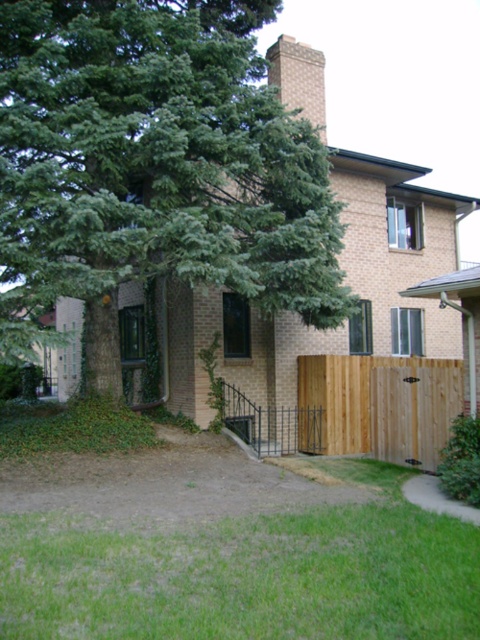
Can you confirm if green leafy tree at upper left is bigger than brown wooden fence at lower right?

Incorrect, green leafy tree at upper left is not larger than brown wooden fence at lower right.

Between green leafy tree at upper left and brown wooden fence at lower right, which one is positioned lower?

brown wooden fence at lower right

Locate an element on the screen. Image resolution: width=480 pixels, height=640 pixels. green leafy tree at upper left is located at coordinates (156, 164).

This screenshot has height=640, width=480. I want to click on green leafy tree at upper left, so click(156, 164).

Which of these two, brown wooden fence at lower right or brick chimney at upper center, stands taller?

Standing taller between the two is brick chimney at upper center.

Does brown wooden fence at lower right appear on the left side of brick chimney at upper center?

In fact, brown wooden fence at lower right is to the right of brick chimney at upper center.

Where is `brown wooden fence at lower right`? Image resolution: width=480 pixels, height=640 pixels. brown wooden fence at lower right is located at coordinates (375, 404).

Can you confirm if green leafy tree at upper left is shorter than brick chimney at upper center?

Yes, green leafy tree at upper left is shorter than brick chimney at upper center.

Who is more forward, (8, 36) or (278, 56)?

Point (8, 36) is more forward.

Is point (101, 374) farther from viewer compared to point (284, 83)?

No, (101, 374) is in front of (284, 83).

Where is `green leafy tree at upper left`? green leafy tree at upper left is located at coordinates (156, 164).